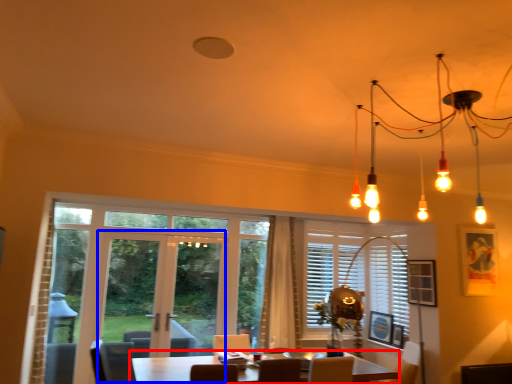
Question: Which object appears farthest to the camera in this image, table (highlighted by a red box) or screen door (highlighted by a blue box)?

Choices:
 (A) table
 (B) screen door

Answer: (B)